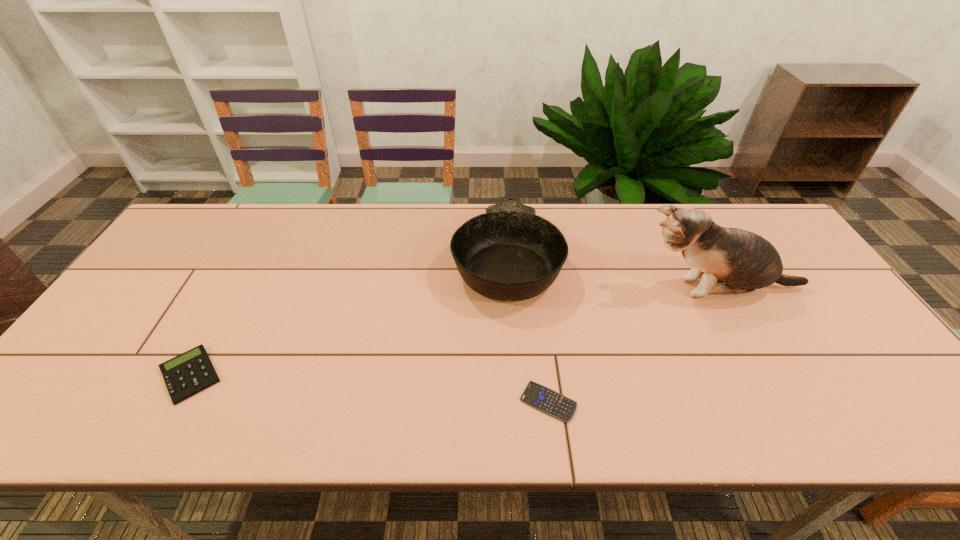
The width and height of the screenshot is (960, 540). I want to click on free space located 0.400m on the back of the left calculator, so click(263, 244).

You are a GUI agent. You are given a task and a screenshot of the screen. Output one action in this format:
    pyautogui.click(x=<x>, y=<y>)
    Task: Click on the free region located on the left of the right calculator
    The image size is (960, 540).
    Given the screenshot: What is the action you would take?
    [348, 402]

Identify the location of object at the far edge. (508, 253).

Image resolution: width=960 pixels, height=540 pixels. What are the coordinates of `object that is at the right edge` in the screenshot? It's located at coord(745,261).

What are the coordinates of `free region at the near edge of the desktop` in the screenshot? It's located at (126, 427).

Where is `free space at the left edge of the desktop`? The height and width of the screenshot is (540, 960). free space at the left edge of the desktop is located at coordinates (147, 279).

Locate an element on the screen. The image size is (960, 540). free space at the far right corner of the desktop is located at coordinates (724, 215).

In the image, there is a desktop. Identify the location of free space at the near right corner. The height and width of the screenshot is (540, 960). pyautogui.click(x=871, y=418).

The width and height of the screenshot is (960, 540). What are the coordinates of `vacant area that lies between the tallest object and the shortest object` in the screenshot? It's located at (634, 345).

Find the location of `free space between the second shortest object and the shorter calculator`. free space between the second shortest object and the shorter calculator is located at coordinates (370, 389).